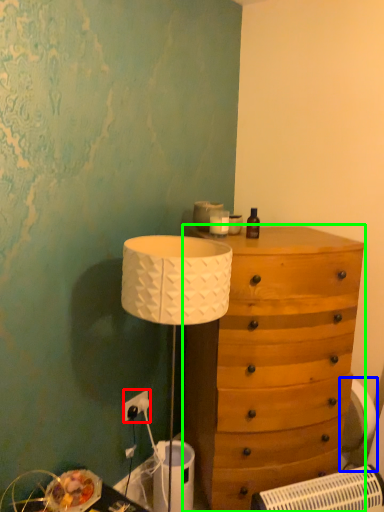
Question: Which object is positioned farthest from electric outlet (highlighted by a red box)? Select from swivel chair (highlighted by a blue box) and chest of drawers (highlighted by a green box).

Choices:
 (A) swivel chair
 (B) chest of drawers

Answer: (A)